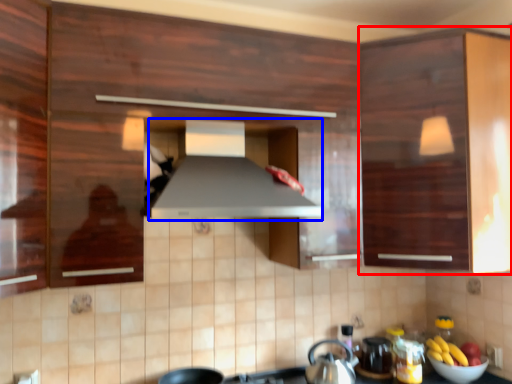
Question: Which object is further to the camera taking this photo, cabinetry (highlighted by a red box) or exhaust hood (highlighted by a blue box)?

Choices:
 (A) cabinetry
 (B) exhaust hood

Answer: (A)